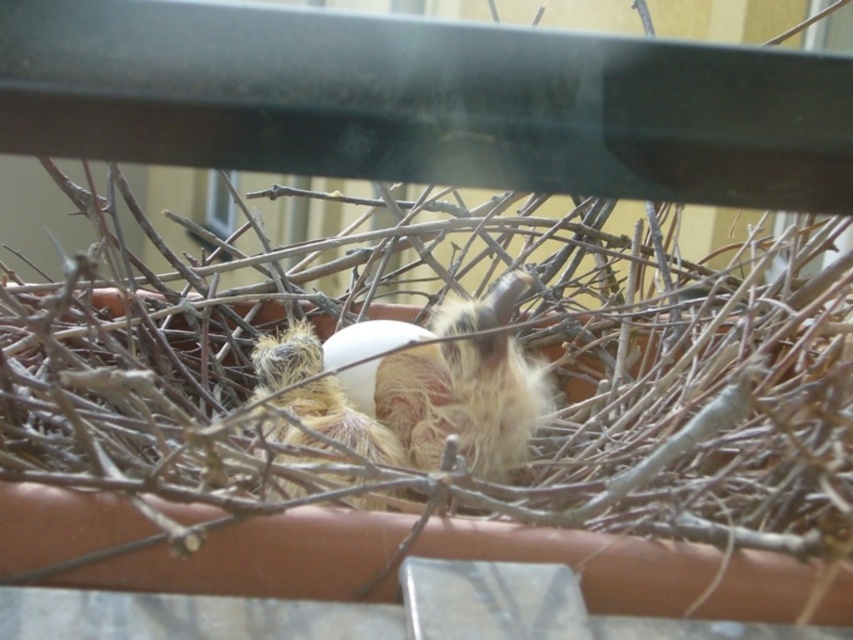
In the scene shown: Can you confirm if fluffy downy bird at center is positioned below fuzzy downy bird at center?

No.

What do you see at coordinates (465, 401) in the screenshot? The width and height of the screenshot is (853, 640). I see `fluffy downy bird at center` at bounding box center [465, 401].

Which is in front, point (403, 400) or point (379, 435)?

Point (379, 435) is in front.

You are a GUI agent. You are given a task and a screenshot of the screen. Output one action in this format:
    pyautogui.click(x=<x>, y=<y>)
    Task: Click on the fluffy downy bird at center
    
    Given the screenshot: What is the action you would take?
    pyautogui.click(x=465, y=401)